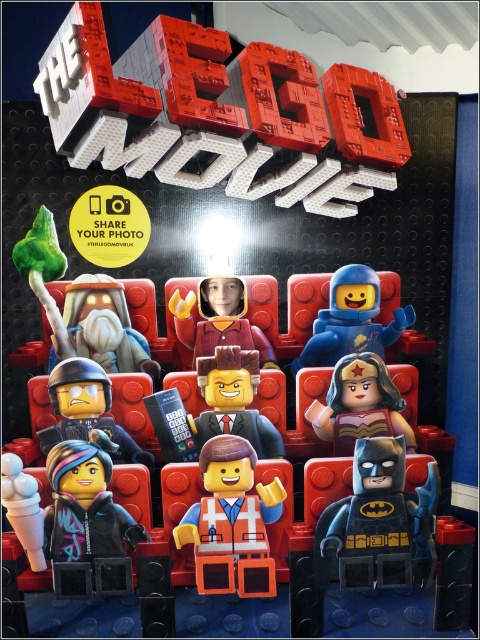
You are a photographer standing in front of the LEGO movie theater scene. You notice two points marked in the image. Which point, point (375, 385) or point (253, 337), is closer to you?

Point (375, 385) is closer to the viewer than point (253, 337).